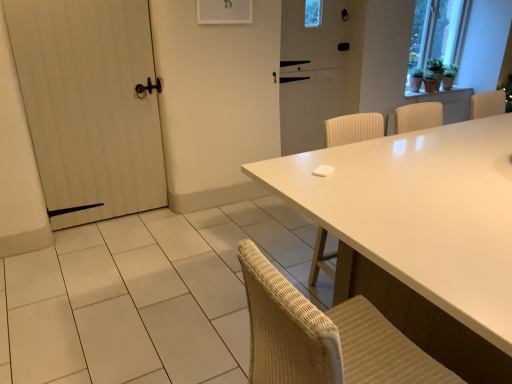
This screenshot has width=512, height=384. I want to click on white glossy table at center, so click(420, 212).

The width and height of the screenshot is (512, 384). Describe the element at coordinates (441, 72) in the screenshot. I see `green matte plant at upper right` at that location.

I want to click on green matte plant at upper right, so click(441, 72).

Measure the distance between white wooden door at left and camera.

They are 7.78 feet apart.

You are a GUI agent. You are given a task and a screenshot of the screen. Output one action in this format:
    pyautogui.click(x=<x>, y=<y>)
    Task: Click on the white glossy table at center
    This screenshot has width=512, height=384.
    Given the screenshot: What is the action you would take?
    pyautogui.click(x=420, y=212)

Consider the image. From a real-world perspective, relative to white wooden door at left, is green matte plant at upper right vertically above or below?

From a real-world perspective, green matte plant at upper right is physically above white wooden door at left.

Which object is further away from the camera taking this photo, green matte plant at upper right or white wooden door at left?

green matte plant at upper right.

Is white wooden door at left at the back of green matte plant at upper right?

That's not correct — green matte plant at upper right is not looking away from white wooden door at left.

Considering the relative sizes of green matte plant at upper right and white wooden door at left in the image provided, is green matte plant at upper right wider than white wooden door at left?

Yes.

Is point (475, 185) closer to camera compared to point (22, 41)?

Yes, it is.

Is white glossy table at center in front of or behind white wooden door at left in the image?

Clearly, white glossy table at center is in front of white wooden door at left.

Is white glossy table at center completely or partially outside of white wooden door at left?

white glossy table at center lies outside white wooden door at left's area.

Who is more distant, white wooden door at left or green matte plant at upper right?

green matte plant at upper right.

How much distance is there between white wooden door at left and green matte plant at upper right?

white wooden door at left and green matte plant at upper right are 3.31 meters apart.

Is point (106, 207) farther from camera compared to point (438, 76)?

That is False.

Does white wooden door at left turn towards green matte plant at upper right?

No.

Is point (430, 69) closer or farther from the camera than point (295, 93)?

Point (430, 69) is positioned farther from the camera compared to point (295, 93).

Which object is thinner, green matte plant at upper right or white matte screen door at center?

white matte screen door at center.

Is green matte plant at upper right taller than white matte screen door at center?

No.

Is the depth of white matte screen door at center less than that of green matte plant at upper right?

Yes, it is.

Identify the location of plant behind the white matte screen door at center. Image resolution: width=512 pixels, height=384 pixels. (441, 72).

Is white matte screen door at center bigger or smaller than green matte plant at upper right?

In the image, white matte screen door at center appears to be larger than green matte plant at upper right.

From the image's perspective, is white wooden door at left located above white glossy table at center?

Yes.

Identify the location of door above the white glossy table at center (from a real-world perspective). This screenshot has height=384, width=512. (89, 104).

Is point (110, 207) closer or farther from the camera than point (383, 154)?

Point (110, 207).

From a real-world perspective, is white wooden door at left under white matte screen door at center?

Yes, from a real-world perspective, white wooden door at left is under white matte screen door at center.

Does white wooden door at left come in front of white matte screen door at center?

Yes, white wooden door at left is closer to the camera.

Based on the photo, is white wooden door at left positioned with its back to white matte screen door at center?

That's not correct — white wooden door at left is not looking away from white matte screen door at center.

Are white wooden door at left and white matte screen door at center far apart?

Yes, white wooden door at left and white matte screen door at center are located far from each other.

Find the location of a particular element. plant above the white wooden door at left (from the image's perspective) is located at coordinates (441, 72).

Find the location of a particular element. This screenshot has width=512, height=384. table that appears in front of the white wooden door at left is located at coordinates [420, 212].

From the image, which object appears to be farther from white matte screen door at center, green matte plant at upper right or white wooden door at left?

white wooden door at left is further to white matte screen door at center.

Looking at the image, which one is located further to white glossy table at center, white wooden door at left or green matte plant at upper right?

green matte plant at upper right.

Based on their spatial positions, is white wooden door at left or white glossy table at center closer to green matte plant at upper right?

white glossy table at center.

Looking at the image, which one is located closer to green matte plant at upper right, white wooden door at left or white matte screen door at center?

white matte screen door at center lies closer to green matte plant at upper right than the other object.

Estimate the real-world distances between objects in this image. Which object is closer to white wooden door at left, green matte plant at upper right or white matte screen door at center?

white matte screen door at center.

Looking at the image, which one is located further to green matte plant at upper right, white matte screen door at center or white glossy table at center?

white glossy table at center.

Which object lies nearer to the anchor point white glossy table at center, white matte screen door at center or green matte plant at upper right?

Based on the image, white matte screen door at center appears to be nearer to white glossy table at center.

Which object lies nearer to the anchor point white wooden door at left, white glossy table at center or green matte plant at upper right?

white glossy table at center is closer to white wooden door at left.

Find the location of a particular element. This screenshot has height=384, width=512. door located between white glossy table at center and white matte screen door at center in the depth direction is located at coordinates (89, 104).

I want to click on door located between white glossy table at center and green matte plant at upper right in the depth direction, so click(89, 104).

Where is `screen door located between white glossy table at center and green matte plant at upper right in the depth direction`? The height and width of the screenshot is (384, 512). screen door located between white glossy table at center and green matte plant at upper right in the depth direction is located at coordinates (311, 73).

The image size is (512, 384). I want to click on screen door between white wooden door at left and green matte plant at upper right in the horizontal direction, so click(311, 73).